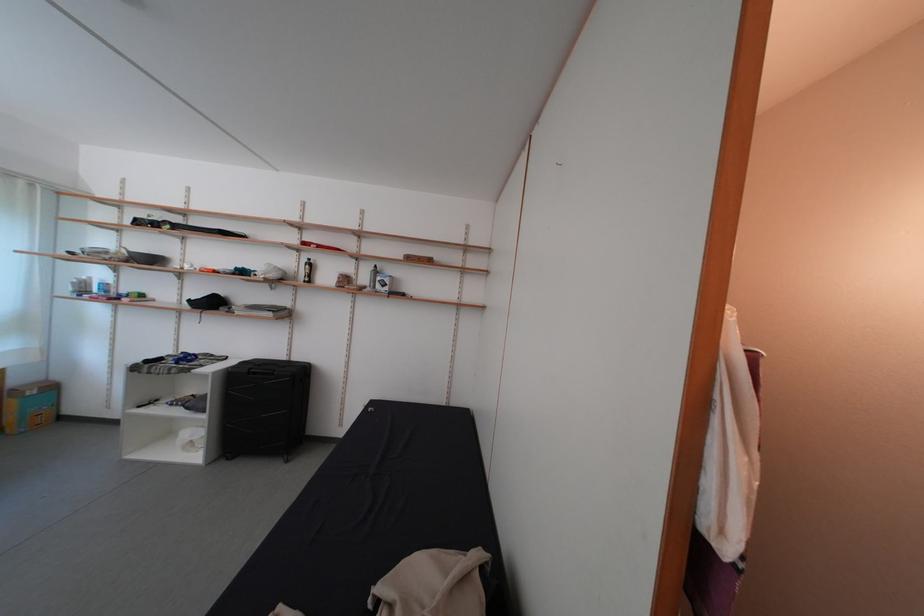
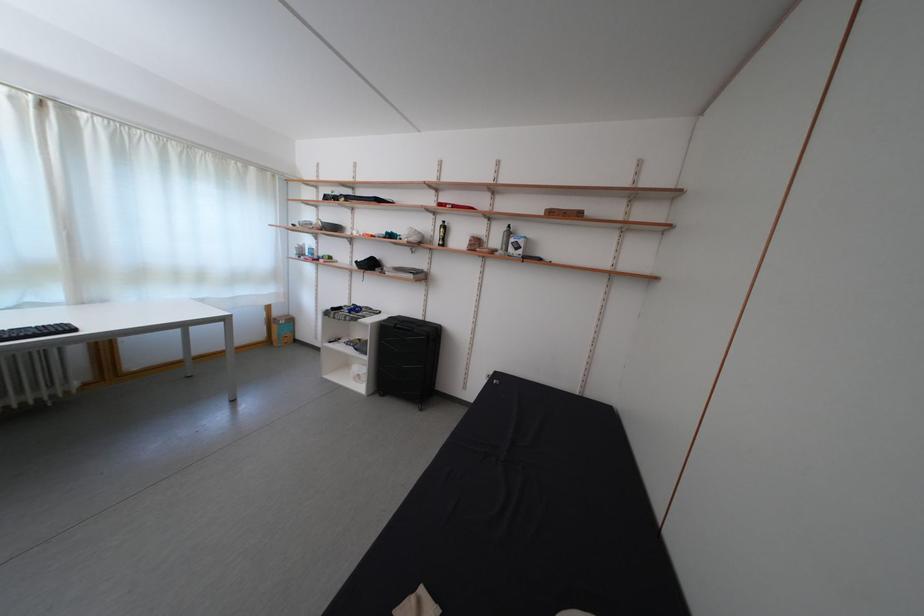
Find the pixel in the second image that matches the point at 252,369 in the first image.

(399, 323)